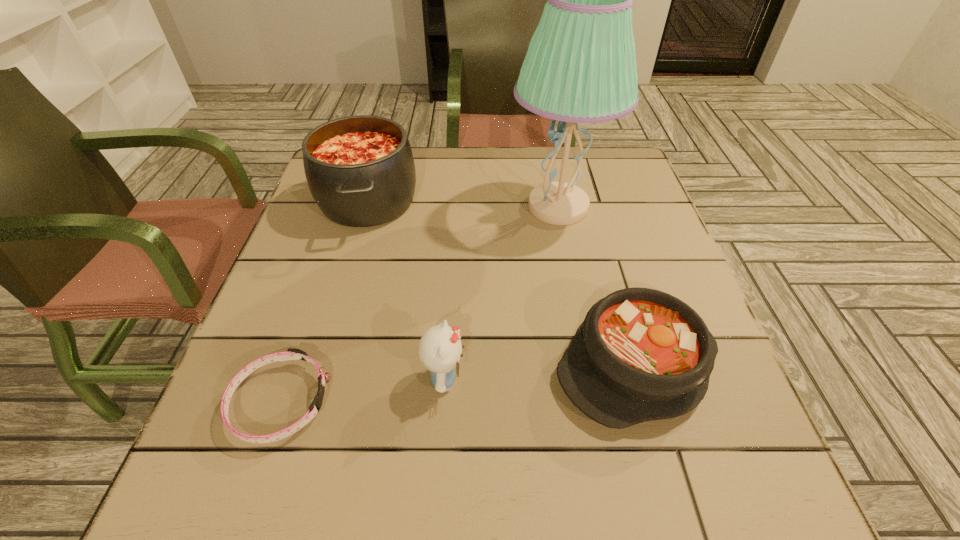
Identify the location of unoccupied position between the shortest object and the lamp. The width and height of the screenshot is (960, 540). (420, 305).

Identify the location of free space between the nearer casserole and the taller casserole. The height and width of the screenshot is (540, 960). (502, 283).

Locate an element on the screen. Image resolution: width=960 pixels, height=540 pixels. vacant area between the third shortest object and the tallest object is located at coordinates (501, 293).

The image size is (960, 540). I want to click on vacant area between the second shortest object and the left casserole, so click(502, 283).

Locate an element on the screen. The image size is (960, 540). empty space between the dog collar and the third tallest object is located at coordinates (362, 390).

Identify the location of empty location between the lamp and the kitten. (501, 293).

Identify the location of the third closest object to the lamp. (440, 349).

Identify the location of object that is the fourth closest one to the shorter casserole. (291, 354).

Find the location of a particular element. The height and width of the screenshot is (540, 960). vacant area that satisfies the following two spatial constraints: 1. on the front side of the shorter casserole; 2. with the buckle on the shortest object is located at coordinates (646, 402).

Locate an element on the screen. The image size is (960, 540). vacant position in the image that satisfies the following two spatial constraints: 1. on the front side of the tallest object; 2. with the buckle on the shortest object is located at coordinates (597, 402).